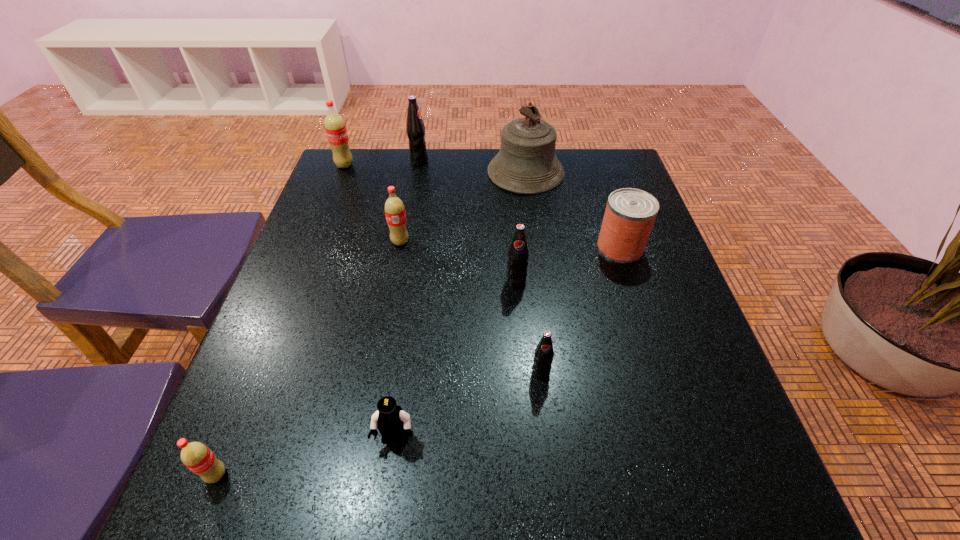
In the image, there is a desktop. At what (x,y) coordinates should I click in order to perform the action: click on vacant space at the near edge. Please return your answer as a coordinate pair (x, y). This screenshot has height=540, width=960. Looking at the image, I should click on (530, 528).

Identify the location of free location at the left edge of the desktop. (350, 296).

Find the location of a particular element. vacant space at the right edge of the desktop is located at coordinates (706, 393).

Find the location of a particular element. blank space at the far left corner of the desktop is located at coordinates (378, 163).

Find the location of a particular element. blank space at the near left corner of the desktop is located at coordinates (247, 524).

In the image, there is a desktop. Where is `vacant space at the far right corner`? vacant space at the far right corner is located at coordinates (591, 161).

Where is `vacant region between the farthest red soda and the rightmost object`? vacant region between the farthest red soda and the rightmost object is located at coordinates (483, 206).

This screenshot has height=540, width=960. In order to click on free space between the nearest soda and the Lego in this screenshot , I will do `click(306, 457)`.

Where is `vacant area that lies between the nearest object and the sixth farthest object`? vacant area that lies between the nearest object and the sixth farthest object is located at coordinates (366, 378).

Where is `vacant space that is in between the second nearest black pop and the eighth farthest object`? The width and height of the screenshot is (960, 540). vacant space that is in between the second nearest black pop and the eighth farthest object is located at coordinates (456, 360).